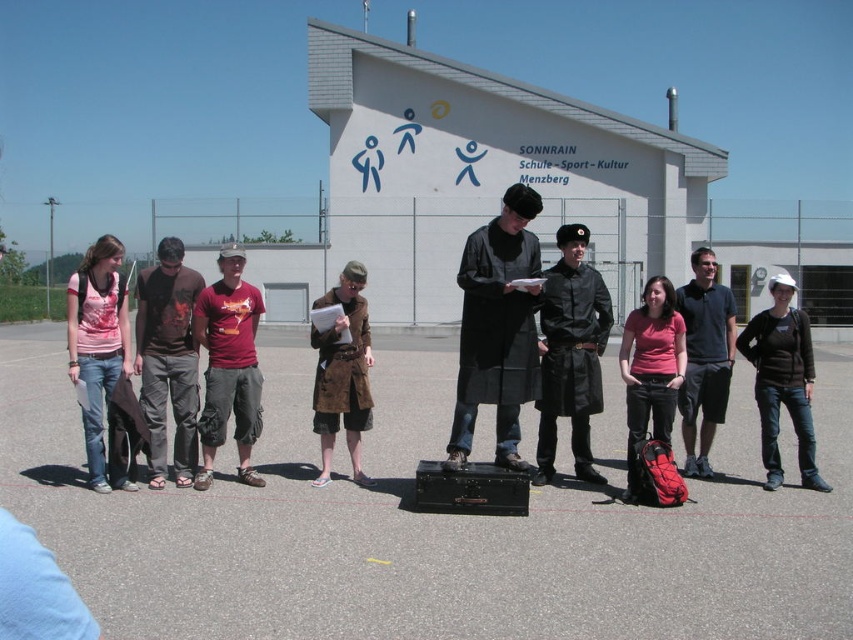
Does white matte baseball cap at center have a greater height compared to pink fabric shirt at center?

Indeed, white matte baseball cap at center has a greater height compared to pink fabric shirt at center.

Is white matte baseball cap at center closer to camera compared to pink fabric shirt at center?

Yes, white matte baseball cap at center is in front of pink fabric shirt at center.

The image size is (853, 640). What are the coordinates of `white matte baseball cap at center` in the screenshot? It's located at (782, 380).

How distant is matte black coat at center from pink fabric shirt at center?

They are 2.56 meters apart.

Is matte black coat at center shorter than pink fabric shirt at center?

In fact, matte black coat at center may be taller than pink fabric shirt at center.

You are a GUI agent. You are given a task and a screenshot of the screen. Output one action in this format:
    pyautogui.click(x=<x>, y=<y>)
    Task: Click on the matte black coat at center
    This screenshot has height=640, width=853.
    Given the screenshot: What is the action you would take?
    pyautogui.click(x=497, y=328)

Find the location of a particular element. matte black coat at center is located at coordinates (497, 328).

Between matte red t-shirt at center and matte pink shirt at center, which one is positioned lower?

matte pink shirt at center is below.

Is matte red t-shirt at center shorter than matte pink shirt at center?

In fact, matte red t-shirt at center may be taller than matte pink shirt at center.

Which is behind, point (239, 356) or point (674, 396)?

The point (674, 396) is behind.

The height and width of the screenshot is (640, 853). Identify the location of matte red t-shirt at center. (229, 365).